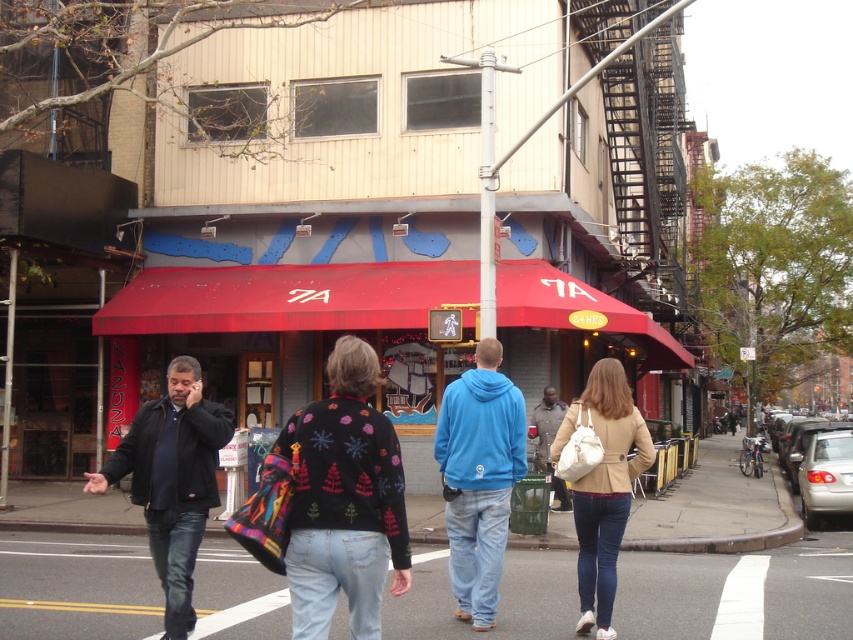
Question: Is smooth asphalt road at center closer to the viewer compared to blue cotton hoodie at center?

Choices:
 (A) yes
 (B) no

Answer: (A)

Question: Can you confirm if dark blue jacket at left is positioned to the right of beige leather jacket at center?

Choices:
 (A) no
 (B) yes

Answer: (A)

Question: Can you confirm if blue cotton hoodie at center is smaller than beige leather jacket at center?

Choices:
 (A) yes
 (B) no

Answer: (A)

Question: Among these objects, which one is farthest from the camera?

Choices:
 (A) black sweater with colorful patterns at center
 (B) blue cotton hoodie at center
 (C) dark blue jacket at left
 (D) smooth asphalt road at center

Answer: (B)

Question: Which point appears closest to the camera in this image?

Choices:
 (A) (595, 406)
 (B) (187, 492)
 (C) (376, 566)

Answer: (C)

Question: Estimate the real-world distances between objects in this image. Which object is closer to the smooth asphalt road at center?

Choices:
 (A) beige leather jacket at center
 (B) black sweater with colorful patterns at center

Answer: (A)